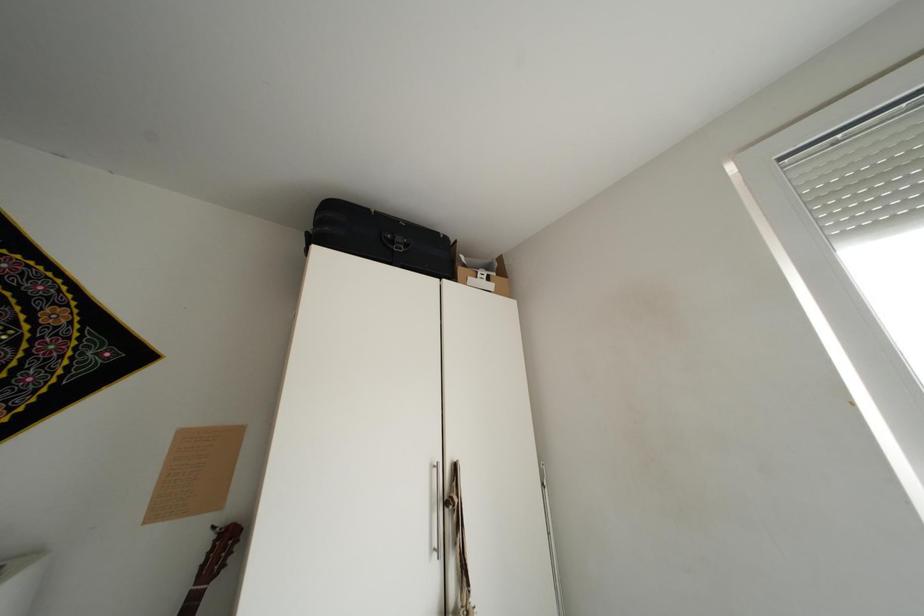
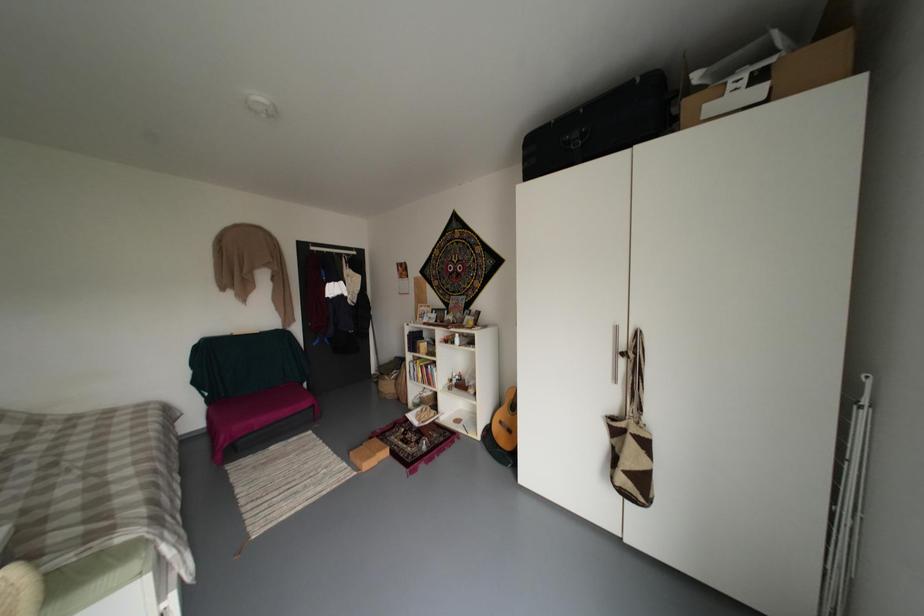
Question: The camera is either moving clockwise (left) or counter-clockwise (right) around the object. The first image is from the beginning of the video and the second image is from the end. Is the camera moving left or right when shooting the video?

Choices:
 (A) Left
 (B) Right

Answer: (B)